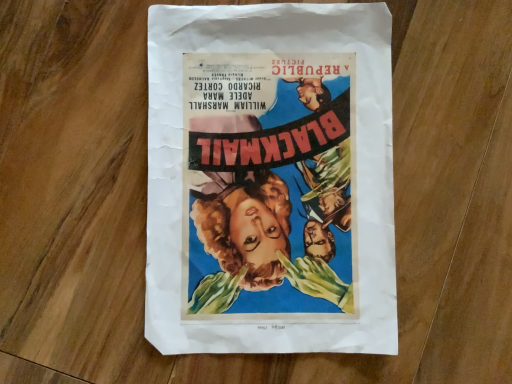
I want to click on blank space above matte paper poster at center (from a real-world perspective), so click(x=267, y=170).